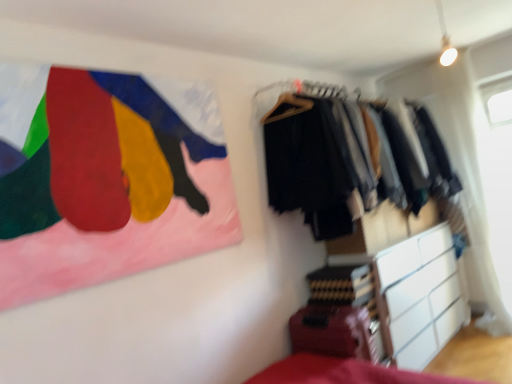
Question: From the image's perspective, is white matte chest of drawers at lower right beneath textured fabric clothes at right?

Choices:
 (A) yes
 (B) no

Answer: (A)

Question: Can you confirm if white matte chest of drawers at lower right is taller than textured fabric clothes at right?

Choices:
 (A) yes
 (B) no

Answer: (B)

Question: Is white matte chest of drawers at lower right facing towards textured fabric clothes at right?

Choices:
 (A) yes
 (B) no

Answer: (B)

Question: From a real-world perspective, is white matte chest of drawers at lower right located higher than textured fabric clothes at right?

Choices:
 (A) no
 (B) yes

Answer: (A)

Question: Considering the relative sizes of white matte chest of drawers at lower right and textured fabric clothes at right in the image provided, is white matte chest of drawers at lower right shorter than textured fabric clothes at right?

Choices:
 (A) no
 (B) yes

Answer: (B)

Question: Is white matte chest of drawers at lower right far from textured fabric clothes at right?

Choices:
 (A) no
 (B) yes

Answer: (A)

Question: Is white matte chest of drawers at lower right wider than painted fabric flag at upper left?

Choices:
 (A) yes
 (B) no

Answer: (A)

Question: Is white matte chest of drawers at lower right bigger than painted fabric flag at upper left?

Choices:
 (A) no
 (B) yes

Answer: (B)

Question: From a real-world perspective, is white matte chest of drawers at lower right under painted fabric flag at upper left?

Choices:
 (A) no
 (B) yes

Answer: (B)

Question: Can you confirm if white matte chest of drawers at lower right is thinner than painted fabric flag at upper left?

Choices:
 (A) yes
 (B) no

Answer: (B)

Question: Can you confirm if white matte chest of drawers at lower right is positioned to the left of painted fabric flag at upper left?

Choices:
 (A) yes
 (B) no

Answer: (B)

Question: Is white matte chest of drawers at lower right touching painted fabric flag at upper left?

Choices:
 (A) yes
 (B) no

Answer: (B)

Question: From the image's perspective, is transparent plastic window screen at upper right over white matte chest of drawers at lower right?

Choices:
 (A) no
 (B) yes

Answer: (B)